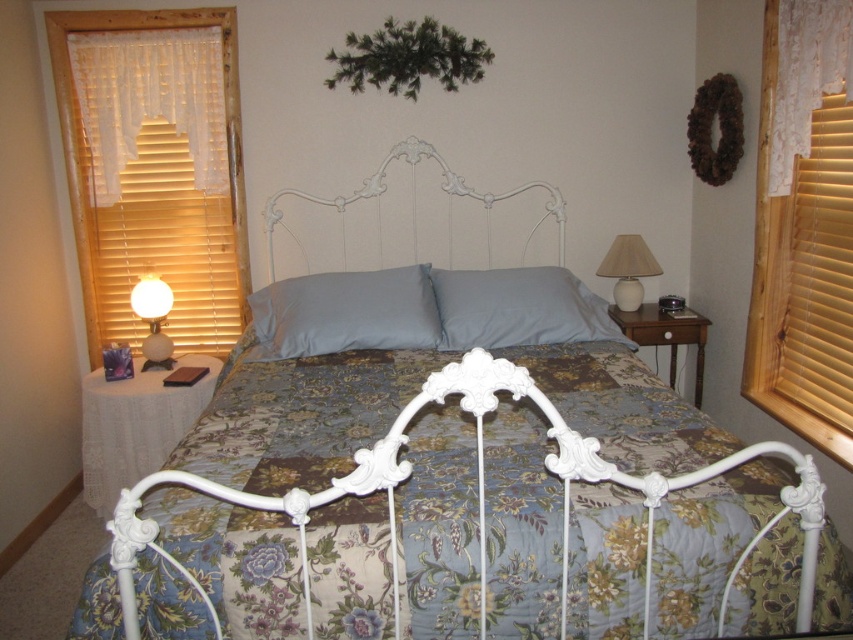
You are standing in the bedroom and want to move from the white wrought iron headboard at center to the floral fabric bed at center. Which direction should you move to reach the bed?

The floral fabric bed at center is to the right of the white wrought iron headboard at center, so you should move to the right to reach the bed.